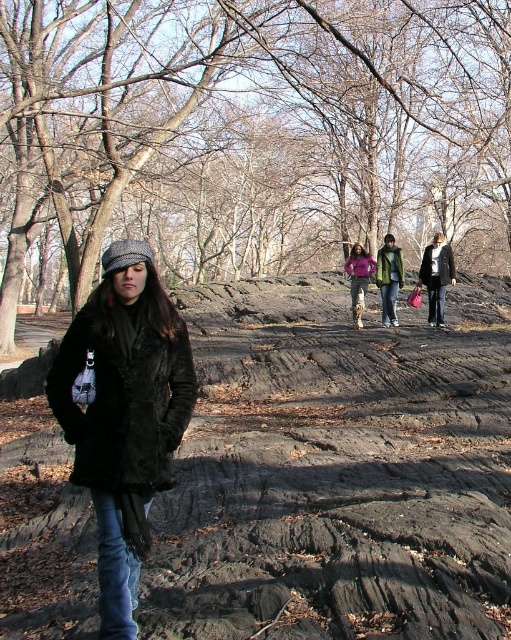
You are a photographer trying to capture a group photo of two people wearing the dark gray woolen coat at center and the green matte jacket at center. The camera you have can only focus on one person at a time. Which person should you focus on to ensure the subject appears larger in the photo?

The dark gray woolen coat at center is bigger than the green matte jacket at center, so you should focus on the person wearing the dark gray woolen coat at center to ensure the subject appears larger in the photo.

You are standing at the point with coordinates point (x=439, y=273) and want to walk towards the point with coordinates point (x=386, y=314). Which direction should you move relative to your current position?

You should move backward because point (x=439, y=273) is in front of point (x=386, y=314), meaning the destination is behind your current position.